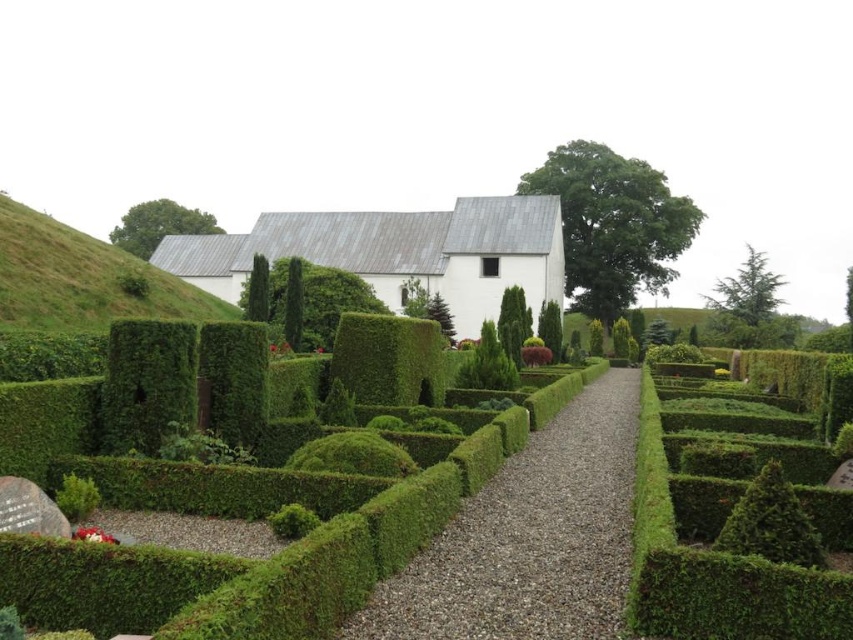
You are standing at the entrance of the garden and see two points marked in the image. The first point is at coordinate point (x=735, y=552) and the second is at point (x=276, y=301). Which point is closer to you as you face the garden entrance?

Point (x=735, y=552) is in front of point (x=276, y=301), so it is closer to you as you face the garden entrance.

You are standing at point A located at coordinates point A at (762, 554). You need to walk to point B, which is 8.90 meters away. Can you estimate how far you need to walk to reach point B?

You need to walk 8.90 meters to reach point B from point A at (762, 554).